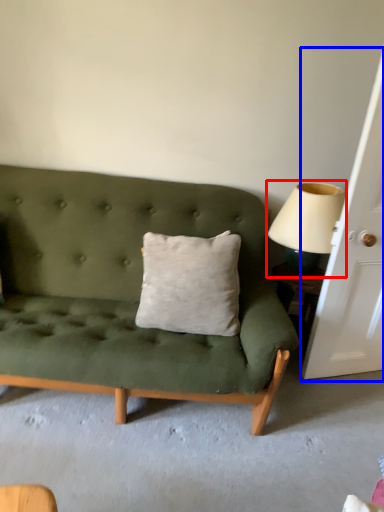
Question: Which object is closer to the camera taking this photo, table lamp (highlighted by a red box) or door (highlighted by a blue box)?

Choices:
 (A) table lamp
 (B) door

Answer: (B)